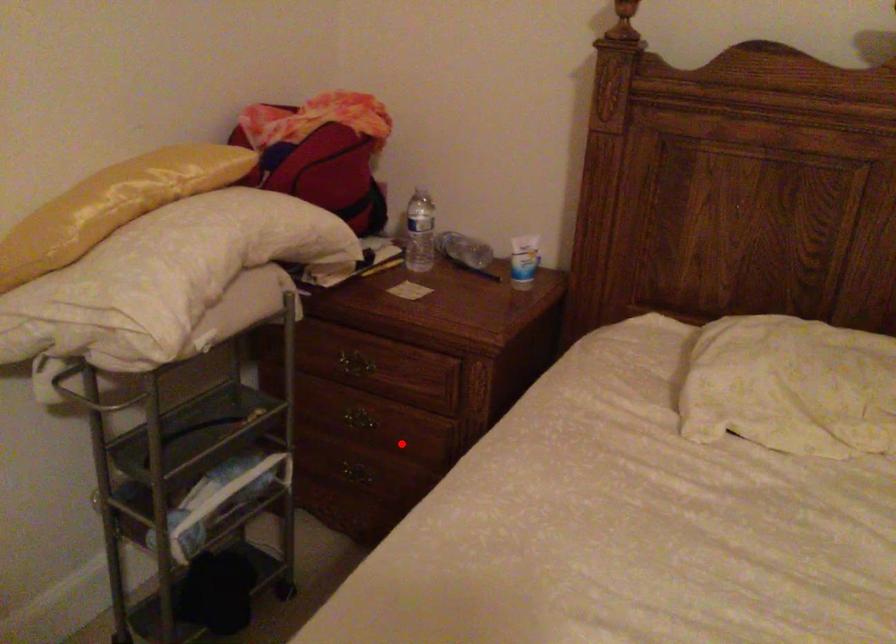
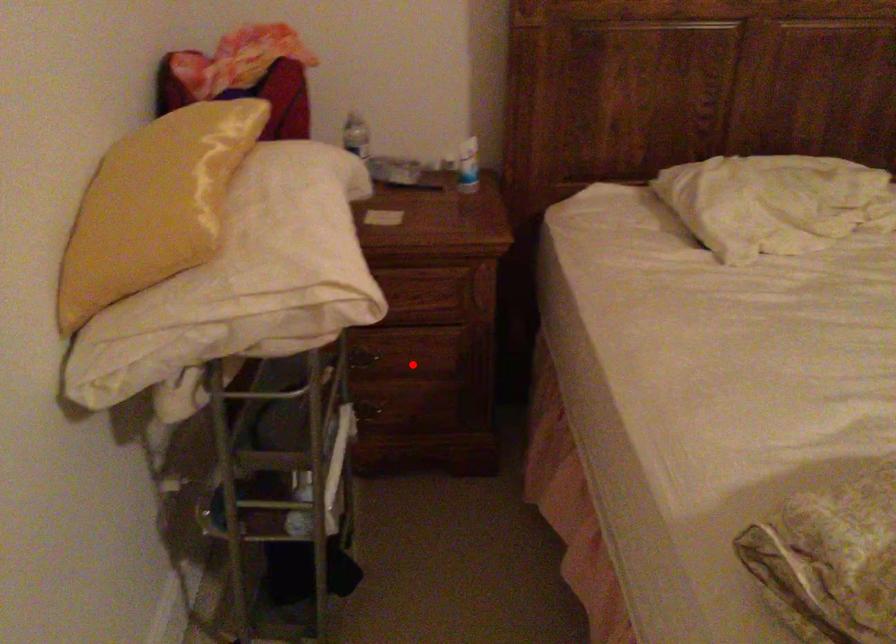
I am providing you with two images of the same scene from different viewpoints. A red point is marked on the first image and another point is marked on the second image. Does the point marked in image1 correspond to the same location as the one in image2?

Yes